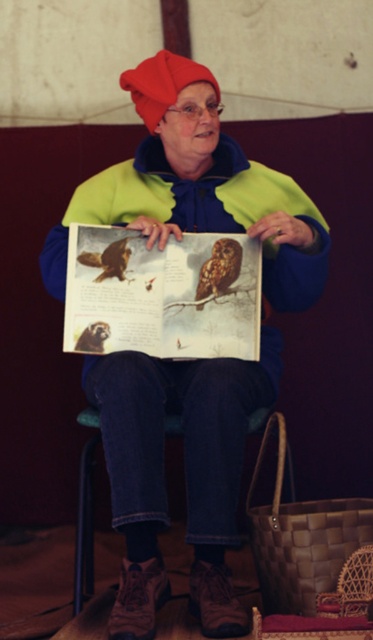
Question: Does matte green jacket at center come behind brown fuzzy owl at center?

Choices:
 (A) no
 (B) yes

Answer: (A)

Question: Which object is closer to the camera taking this photo?

Choices:
 (A) matte paper book at center
 (B) brown fuzzy owl at center

Answer: (A)

Question: In this image, where is matte green jacket at center located relative to brown fuzzy owl at center?

Choices:
 (A) left
 (B) right

Answer: (A)

Question: Which object is positioned farthest from the matte green jacket at center?

Choices:
 (A) brown fuzzy owl at center
 (B) matte paper book at center

Answer: (A)

Question: Which object is closer to the camera taking this photo?

Choices:
 (A) matte paper book at center
 (B) brown fuzzy owl at center

Answer: (A)

Question: Does matte paper book at center have a smaller size compared to brown fuzzy owl at center?

Choices:
 (A) no
 (B) yes

Answer: (A)